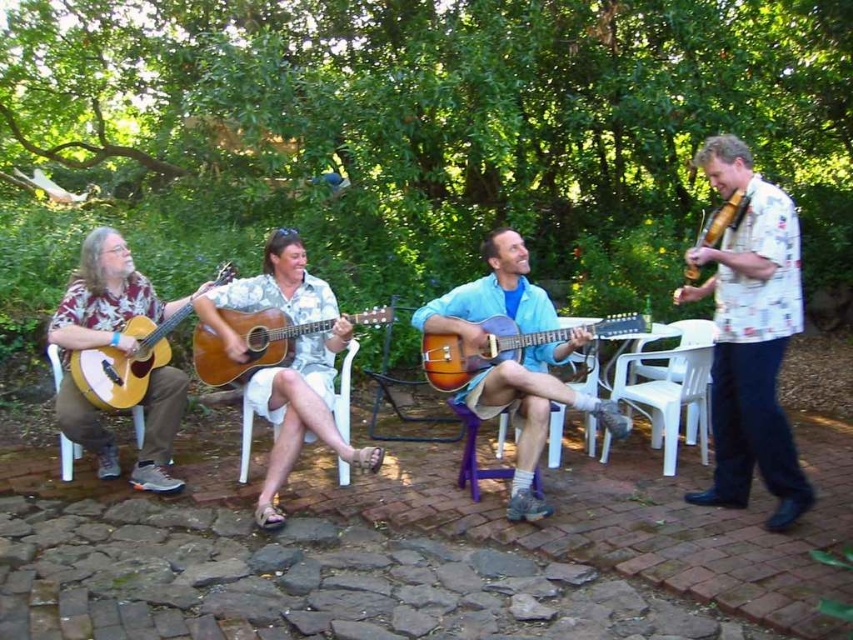
You are organizing a small outdoor concert and need to place the matte brown guitar at left and the purple plastic chair at center in a way that accommodates their sizes. Which object should you prioritize placing first to ensure there is enough space?

The matte brown guitar at left is bigger than the purple plastic chair at center, so you should prioritize placing the matte brown guitar at left first to ensure there is enough space.